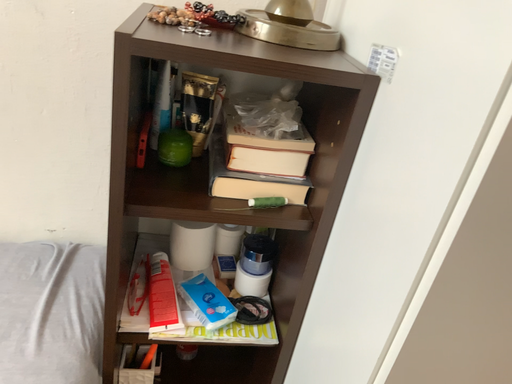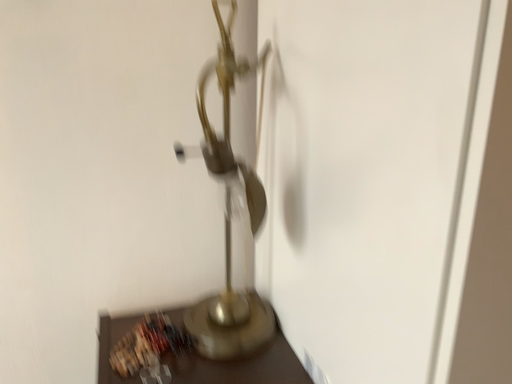
Question: How did the camera likely rotate when shooting the video?

Choices:
 (A) rotated upward
 (B) rotated downward

Answer: (A)